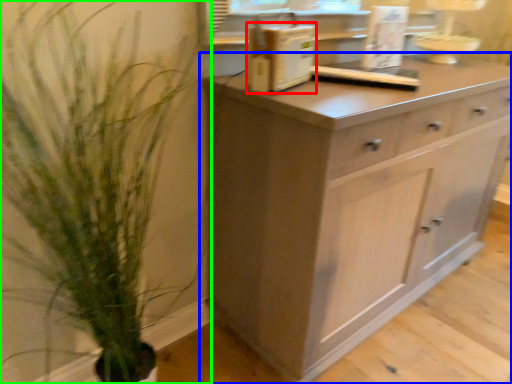
Question: Which object is the farthest from appliance (highlighted by a red box)? Choose among these: chest of drawers (highlighted by a blue box) or houseplant (highlighted by a green box).

Choices:
 (A) chest of drawers
 (B) houseplant

Answer: (B)